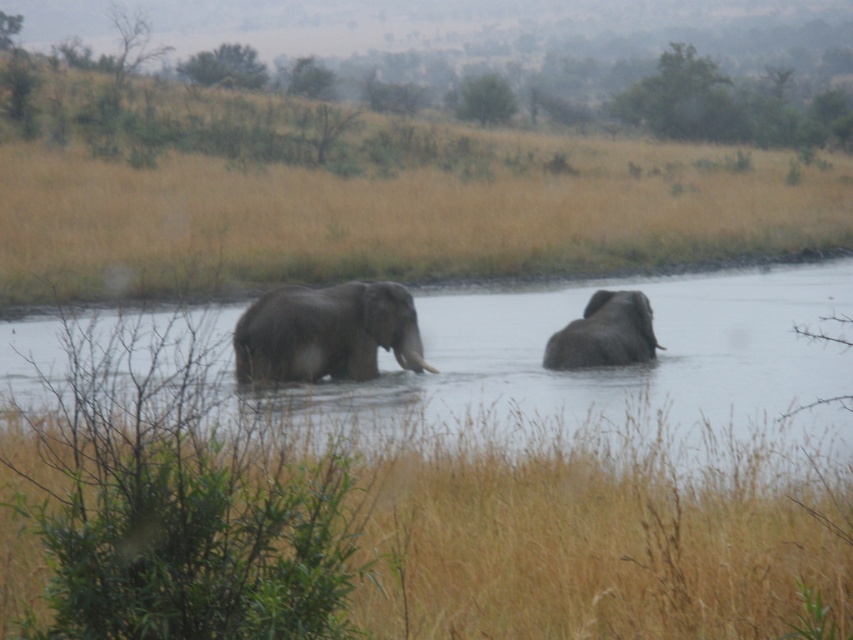
Question: Which of the following is the closest to the observer?

Choices:
 (A) (322, 332)
 (B) (416, 440)
 (C) (547, 461)

Answer: (C)

Question: Can you confirm if dry grass at lower center is positioned to the right of gray matte elephant at center?

Choices:
 (A) no
 (B) yes

Answer: (B)

Question: Is dry grass at lower center positioned in front of gray matte water at center?

Choices:
 (A) yes
 (B) no

Answer: (A)

Question: Which object is positioned closest to the gray matte water at center?

Choices:
 (A) gray matte elephant at center
 (B) gray matte elephant at right

Answer: (B)

Question: Which of the following is the farthest from the observer?

Choices:
 (A) gray matte water at center
 (B) dry grass at center
 (C) dry grass at lower center

Answer: (B)

Question: Is the position of dry grass at lower center less distant than that of gray matte water at center?

Choices:
 (A) yes
 (B) no

Answer: (A)